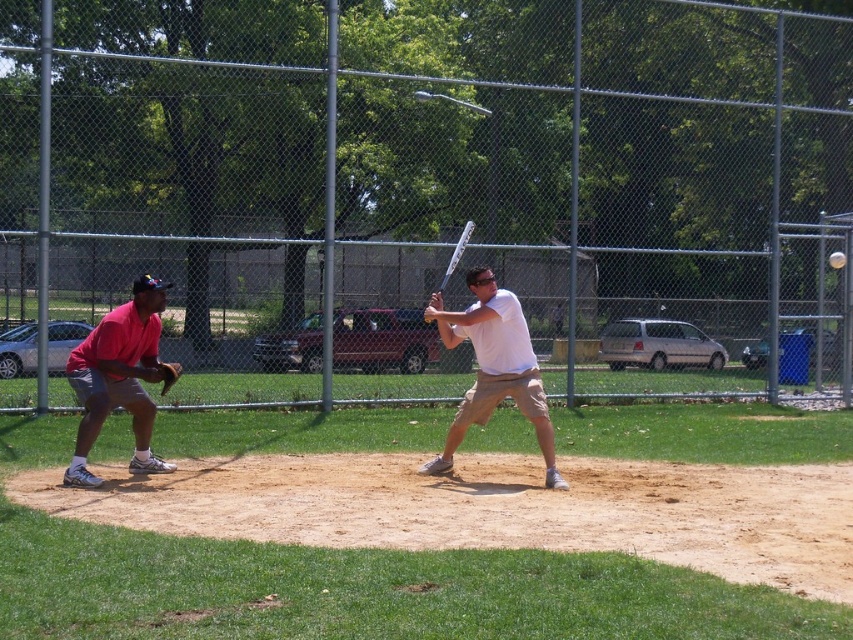
Is matte pink shirt at left below brown leather glove at left?

Incorrect, matte pink shirt at left is not positioned below brown leather glove at left.

Does point (123, 353) come behind point (164, 368)?

No, it is in front of (164, 368).

Locate an element on the screen. matte pink shirt at left is located at coordinates (119, 378).

Where is `matte pink shirt at left`? matte pink shirt at left is located at coordinates (119, 378).

Find the location of a particular element. white matte baseball bat at center is located at coordinates (492, 368).

Which is in front, point (84, 412) or point (840, 262)?

Point (84, 412) is in front.

Can you confirm if matte pink shirt at left is bigger than white matte baseball at center?

Yes.

Which is behind, point (128, 304) or point (828, 260)?

Positioned behind is point (828, 260).

Where is `matte pink shirt at left`? This screenshot has height=640, width=853. matte pink shirt at left is located at coordinates (119, 378).